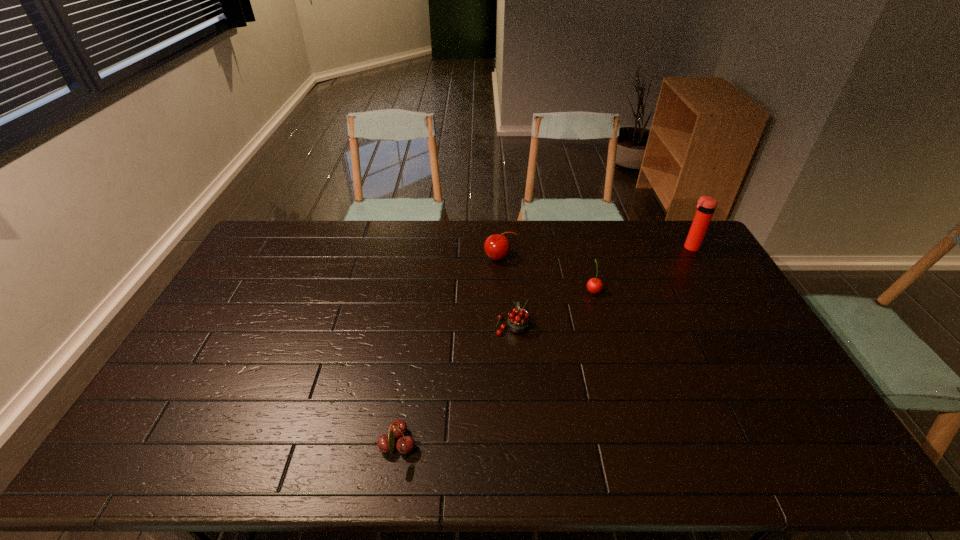
Find the location of a particular element. vacant position located 0.380m on the front of the second object from right to left is located at coordinates (623, 396).

Locate an element on the screen. vacant space located 0.130m on the handle side of the second nearest object is located at coordinates (509, 286).

You are a GUI agent. You are given a task and a screenshot of the screen. Output one action in this format:
    pyautogui.click(x=<x>, y=<y>)
    Task: Click on the vacant space situated 0.170m on the handle side of the second nearest object
    The image size is (960, 540).
    Given the screenshot: What is the action you would take?
    pyautogui.click(x=509, y=278)

Where is `vacant space located 0.190m on the handle side of the second nearest object`? The height and width of the screenshot is (540, 960). vacant space located 0.190m on the handle side of the second nearest object is located at coordinates tap(509, 274).

The image size is (960, 540). I want to click on free space located on the leaves of the nearest object, so click(x=544, y=446).

This screenshot has height=540, width=960. I want to click on thermos bottle that is at the far edge, so click(706, 205).

Identify the location of cherry positioned at the far edge. (497, 246).

The height and width of the screenshot is (540, 960). In order to click on object that is at the near edge in this screenshot , I will do `click(386, 443)`.

Locate an element on the screen. This screenshot has height=540, width=960. object that is at the right edge is located at coordinates (706, 205).

This screenshot has height=540, width=960. Identify the location of object that is at the far right corner. (706, 205).